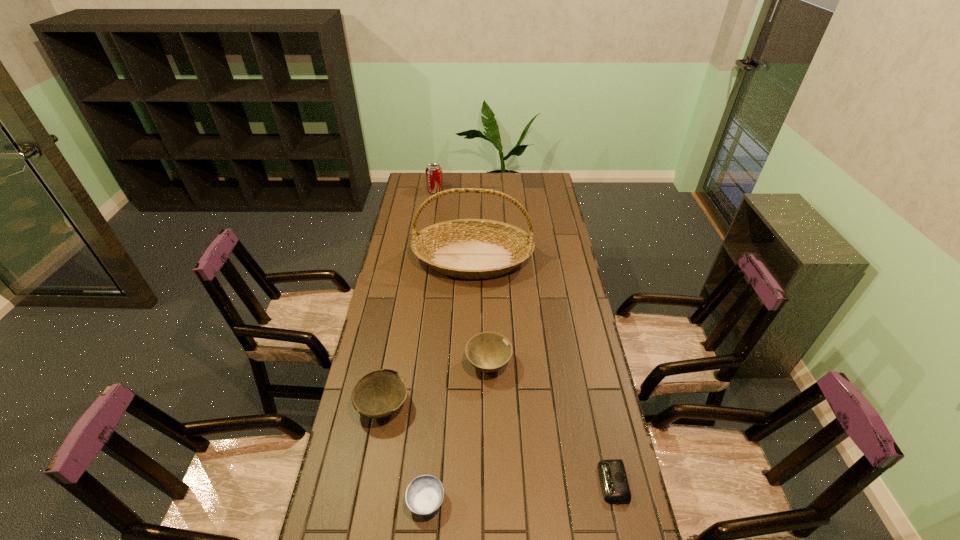
Identify the location of basket. (463, 248).

At what (x,y) coordinates should I click in order to perform the action: click on the tallest object. Please return your answer as a coordinate pair (x, y). The height and width of the screenshot is (540, 960). Looking at the image, I should click on (463, 248).

Find the location of a particular element. The image size is (960, 540). the second tallest object is located at coordinates (434, 179).

Identify the location of the farthest object. (434, 179).

At what (x,y) coordinates should I click in order to perform the action: click on the right bowl. Please return your answer as a coordinate pair (x, y). Looking at the image, I should click on (488, 351).

Identify the location of the left bowl. Image resolution: width=960 pixels, height=540 pixels. (378, 394).

This screenshot has width=960, height=540. I want to click on ashtray, so click(x=424, y=495).

Find the location of a particular element. Image resolution: width=960 pixels, height=540 pixels. the shortest object is located at coordinates (614, 483).

Image resolution: width=960 pixels, height=540 pixels. I want to click on alarm clock, so click(614, 483).

Image resolution: width=960 pixels, height=540 pixels. Identify the location of free space located 0.310m on the back of the basket. (474, 198).